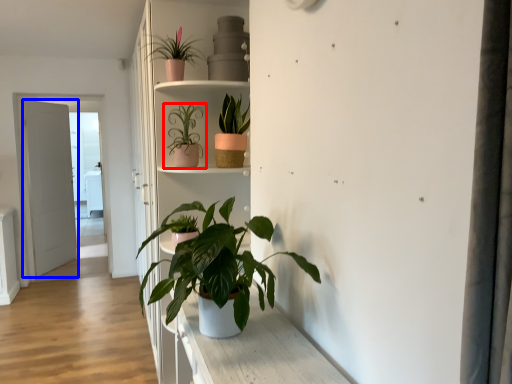
Question: Which of the following is the closest to the observer, houseplant (highlighted by a red box) or door (highlighted by a blue box)?

Choices:
 (A) houseplant
 (B) door

Answer: (A)